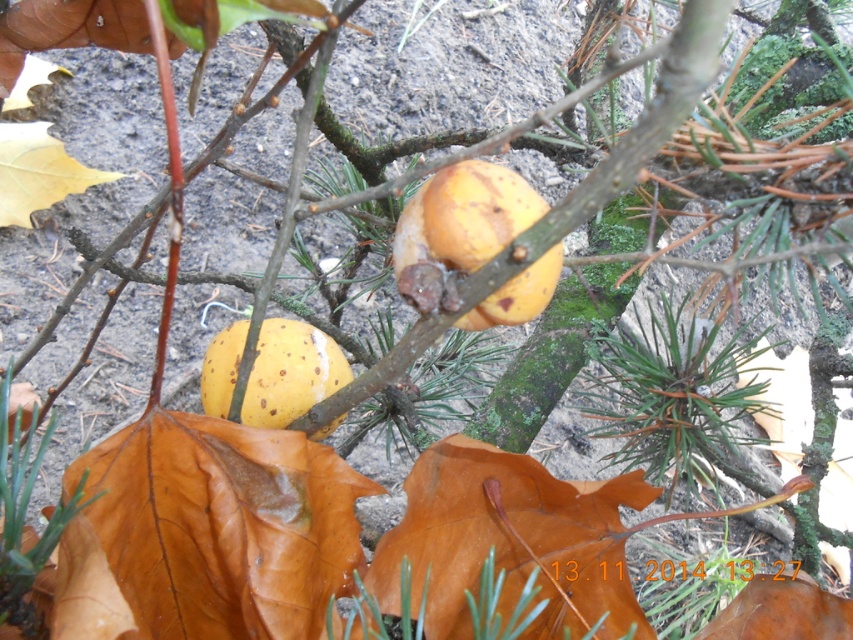
You are a botanist studying the tree branch with fruits. You notice a point marked at coordinates (460, 221). What object is located at this point?

The point at coordinates (460, 221) indicates a yellow matte fruit at center.

You are an apple picker trying to determine which fruit to pick first. Based on the image, which fruit is taller between the yellow matte fruit at center and the yellow matte apple at center?

The yellow matte fruit at center is taller than the yellow matte apple at center, so you should pick the yellow matte fruit at center first.

You are standing in front of the tree branch with two yellowish orange fruits. You notice two points marked on the branch. Which point is closer to you, point (498, 234) or point (343, 358)?

Point (498, 234) is closer to the viewer than point (343, 358).